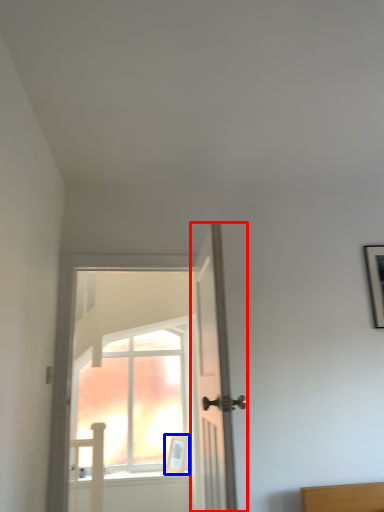
Question: Which point is further to the camera, door (highlighted by a red box) or picture frame (highlighted by a blue box)?

Choices:
 (A) door
 (B) picture frame

Answer: (B)